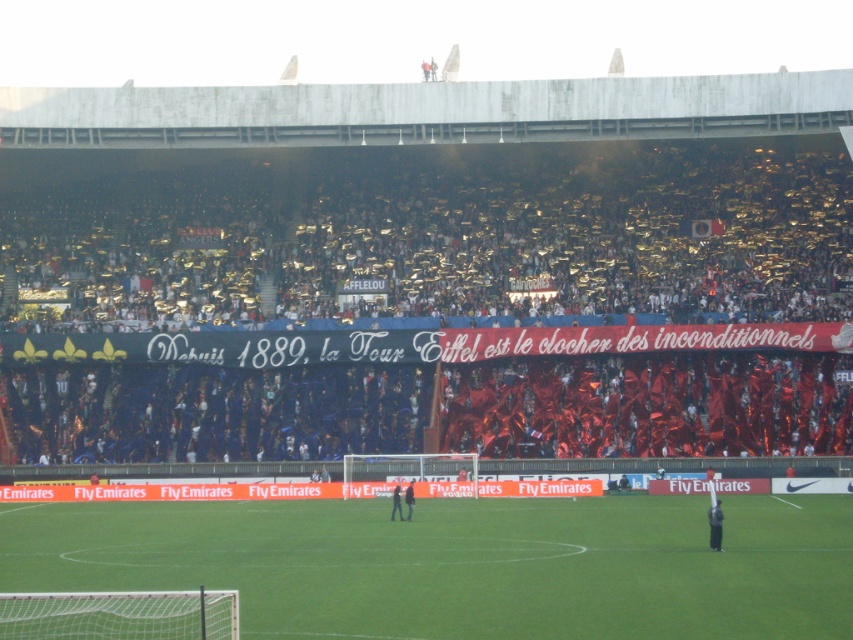
Does green grass football field at center appear under dark gray fabric jacket at center?

Correct, green grass football field at center is located below dark gray fabric jacket at center.

Does green grass football field at center lie in front of dark gray fabric jacket at center?

Yes.

Locate an element on the screen. The width and height of the screenshot is (853, 640). green grass football field at center is located at coordinates (461, 563).

You are a GUI agent. You are given a task and a screenshot of the screen. Output one action in this format:
    pyautogui.click(x=<x>, y=<y>)
    Task: Click on the green grass football field at center
    The height and width of the screenshot is (640, 853).
    Given the screenshot: What is the action you would take?
    pyautogui.click(x=461, y=563)

Between point (720, 545) and point (412, 488), which one is positioned in front?

Point (720, 545) is more forward.

Does dark gray fabric jacket at center appear under dark blue fabric jacket at center?

Yes.

Which is in front, point (715, 506) or point (409, 481)?

Point (715, 506) is in front.

Where is `dark gray fabric jacket at center`? dark gray fabric jacket at center is located at coordinates (715, 524).

Does green grass football field at center lie in front of dark blue jersey at center?

Yes.

Is green grass football field at center positioned behind dark blue jersey at center?

That is False.

At what (x,y) coordinates should I click in order to perform the action: click on green grass football field at center. Please return your answer as a coordinate pair (x, y). Looking at the image, I should click on (461, 563).

The height and width of the screenshot is (640, 853). Find the location of `green grass football field at center`. green grass football field at center is located at coordinates (461, 563).